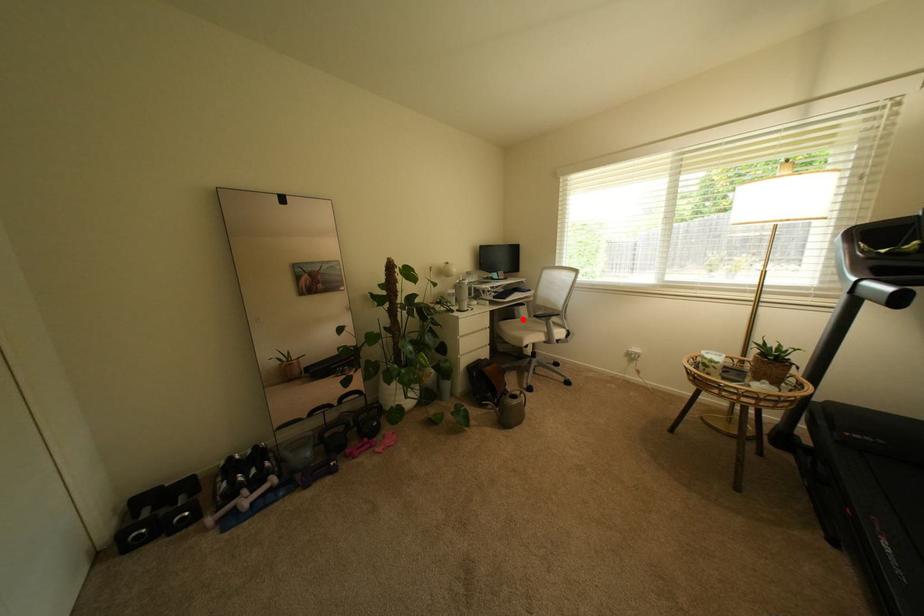
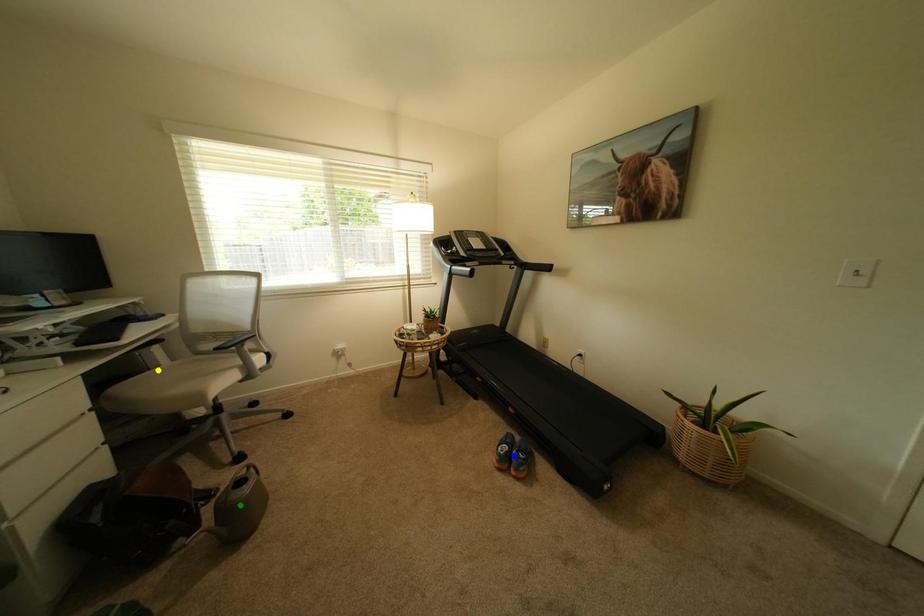
Question: I am providing you with two images of the same scene from different viewpoints. A red point is marked on the first image. You are given multiple points on the second image. Which point in image 2 represents the same 3d spot as the red point in image 1?

Choices:
 (A) green point
 (B) blue point
 (C) yellow point

Answer: (C)